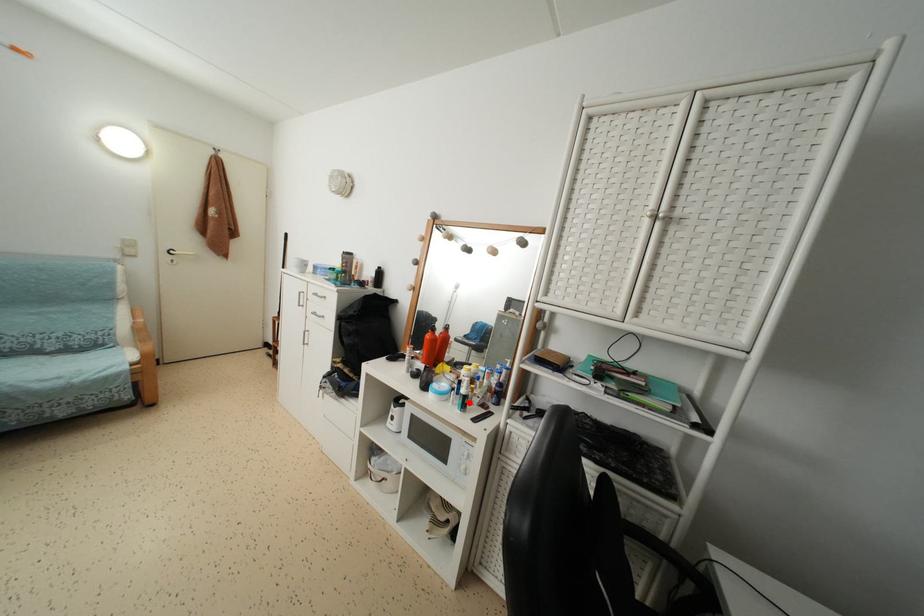
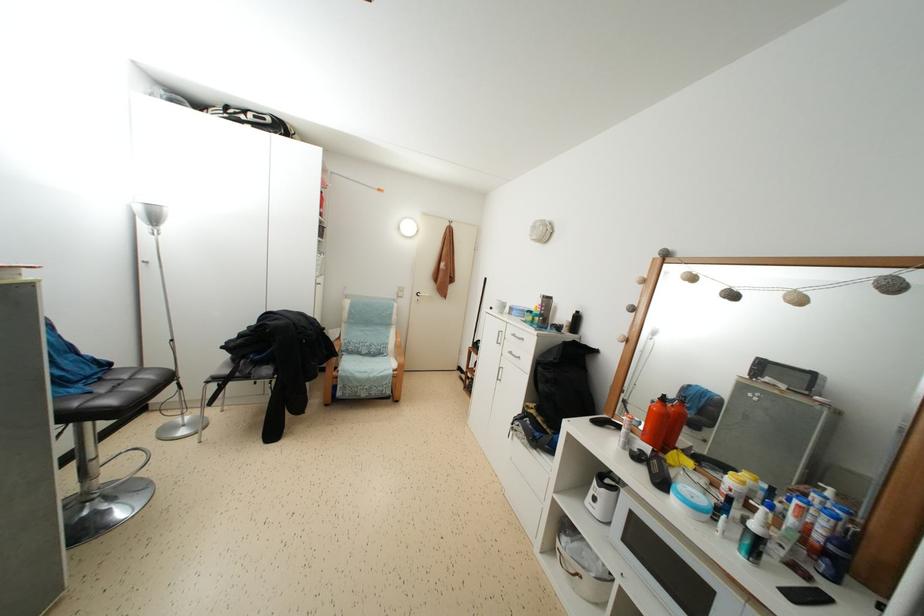
Question: I am providing you with two images of the same scene from different viewpoints. In image1, a red point is highlighted. Considering the same 3D point in image2, which of the following is correct?

Choices:
 (A) It is closer
 (B) It is farther

Answer: (A)